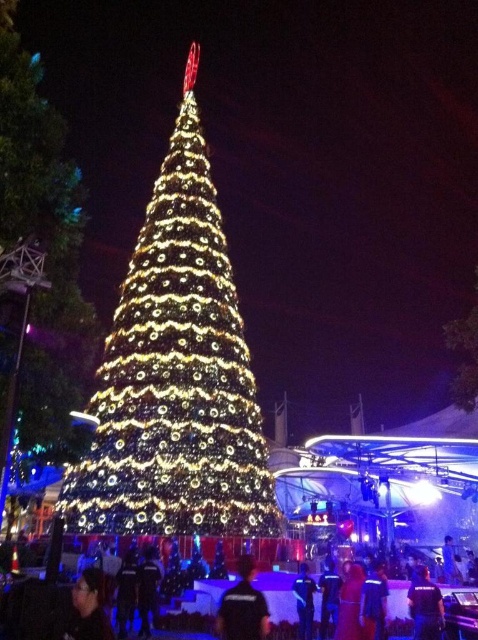
From the picture: You are an event photographer positioned at the front of the stage. You need to capture a clear photo of both the black shirt at lower center and the dark blue uniform at center. Which of the two will appear larger in your photo?

The black shirt at lower center will appear larger in the photo because it is closer to the viewer than the dark blue uniform at center.

You are standing at the center of the stage. Looking down, you see the black shirt at lower center. Where is the black shirt located relative to your position?

The black shirt at lower center is located at point (242, 605) relative to your position.